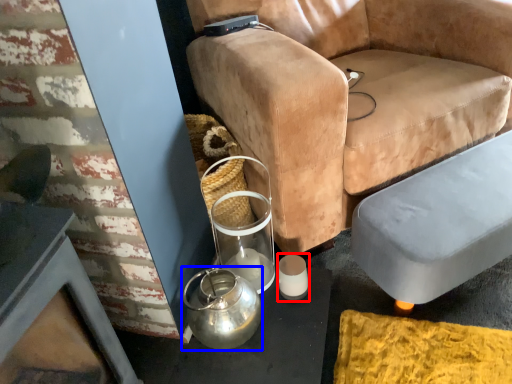
Question: Which point is closer to the camera, candle holder (highlighted by a red box) or tea pot (highlighted by a blue box)?

Choices:
 (A) candle holder
 (B) tea pot

Answer: (B)